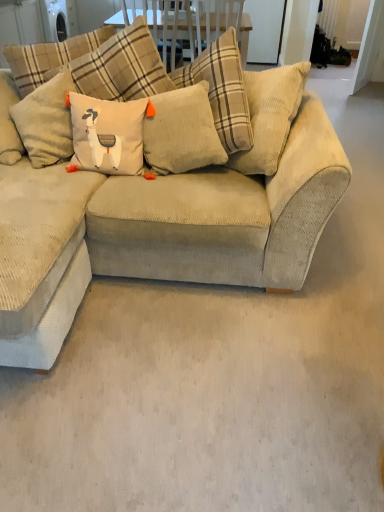
Question: Is beige corduroy couch at center behind corduroy pillow at center?

Choices:
 (A) yes
 (B) no

Answer: (B)

Question: Is corduroy pillow at center inside beige corduroy couch at center?

Choices:
 (A) yes
 (B) no

Answer: (A)

Question: Can you confirm if beige corduroy couch at center is bigger than corduroy pillow at center?

Choices:
 (A) yes
 (B) no

Answer: (A)

Question: From a real-world perspective, is beige corduroy couch at center located beneath corduroy pillow at center?

Choices:
 (A) yes
 (B) no

Answer: (A)

Question: Is there a large distance between beige corduroy couch at center and corduroy pillow at center?

Choices:
 (A) no
 (B) yes

Answer: (A)

Question: From the image's perspective, does beige corduroy couch at center appear higher than corduroy pillow at center?

Choices:
 (A) no
 (B) yes

Answer: (A)

Question: Is corduroy pillow at center surrounding beige corduroy couch at center?

Choices:
 (A) no
 (B) yes

Answer: (A)

Question: Can you confirm if corduroy pillow at center is positioned to the right of beige corduroy couch at center?

Choices:
 (A) no
 (B) yes

Answer: (B)

Question: Is beige corduroy couch at center at the back of corduroy pillow at center?

Choices:
 (A) no
 (B) yes

Answer: (B)

Question: Is corduroy pillow at center not within beige corduroy couch at center?

Choices:
 (A) yes
 (B) no

Answer: (B)

Question: From the image's perspective, is corduroy pillow at center under beige corduroy couch at center?

Choices:
 (A) yes
 (B) no

Answer: (B)

Question: Does corduroy pillow at center turn towards beige corduroy couch at center?

Choices:
 (A) yes
 (B) no

Answer: (A)

Question: Is beige corduroy couch at center taller or shorter than corduroy pillow at center?

Choices:
 (A) short
 (B) tall

Answer: (B)